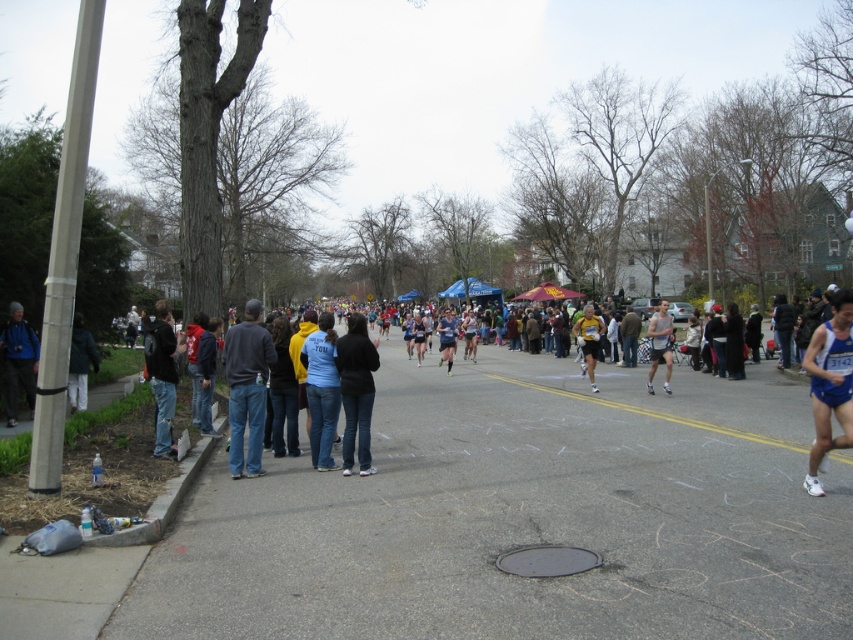
You are a runner participating in the marathon and currently at point [848,429]. You want to reach the finish line located at point [90,352]. Which direction should you move to get closer to the finish line?

Since point [848,429] is in front of point [90,352], you should move backward to reach the finish line located at point [90,352].

You are a runner participating in the marathon and currently at the point labeled as point (630,403). You want to reach the finish line located at point (158,436). Considering your current position, which direction should you move to head towards the finish line?

Since point (630,403) is behind point (158,436), you should move forward towards the direction of point (158,436) to reach the finish line.

You are a runner participating in the marathon. You see the gray asphalt road at lower center and the jeans at left. Which path should you choose to continue running forward?

You should choose the gray asphalt road at lower center because it is bigger than the jeans at left and is the correct path for the marathon route.